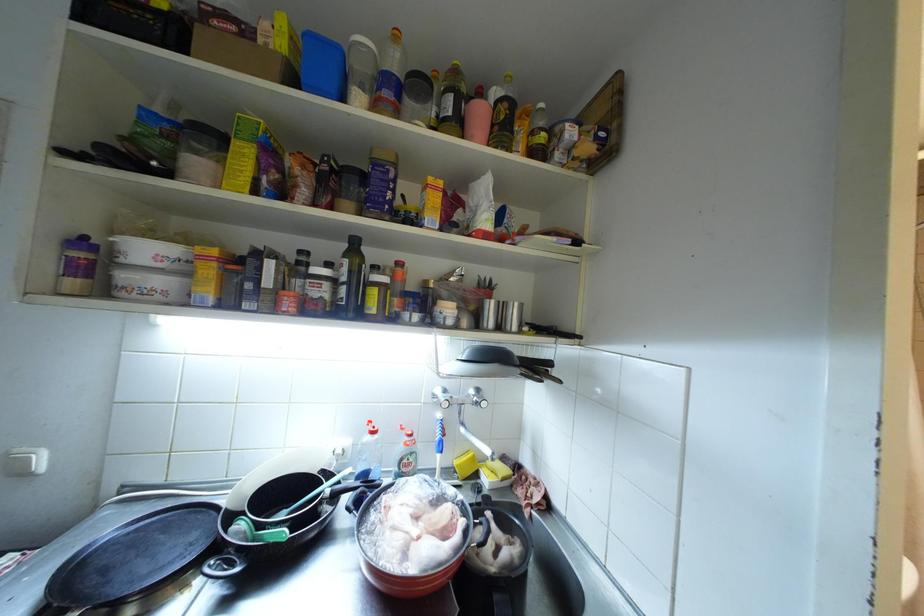
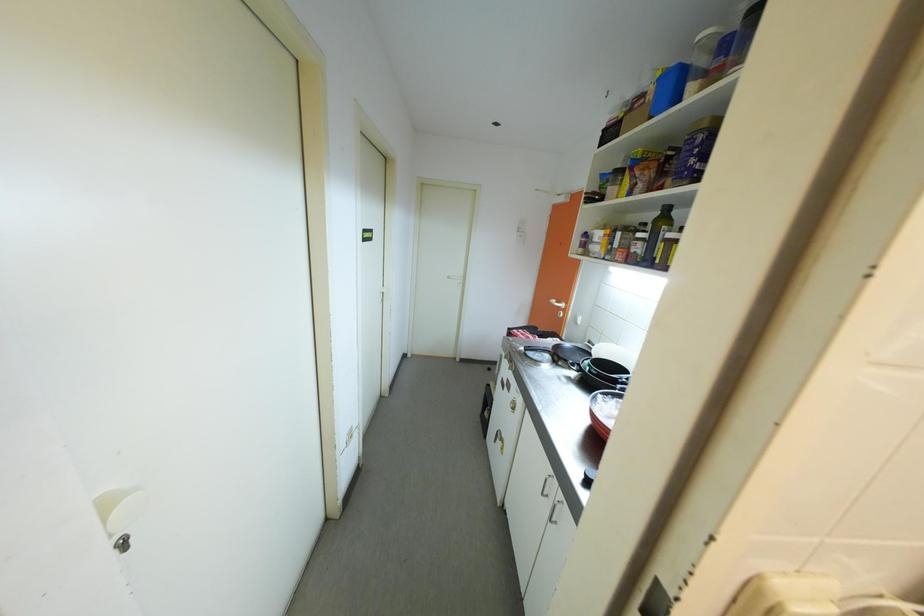
Question: Based on the continuous images, in which direction is the camera rotating? Reply with the corresponding letter.

Choices:
 (A) Left
 (B) Right
 (C) Up
 (D) Down

Answer: (A)